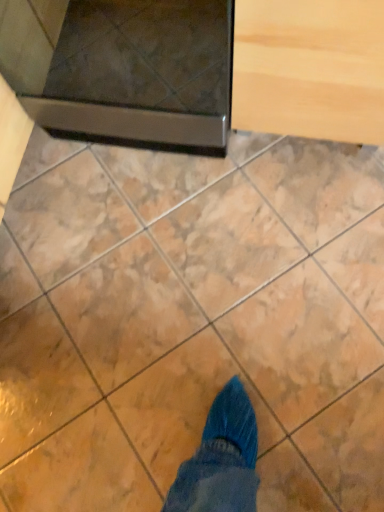
Question: Is metallic dark gray oven at upper left positioned before light wood drawer at upper right?

Choices:
 (A) yes
 (B) no

Answer: (B)

Question: From a real-world perspective, is metallic dark gray oven at upper left on top of light wood drawer at upper right?

Choices:
 (A) yes
 (B) no

Answer: (A)

Question: Is metallic dark gray oven at upper left with light wood drawer at upper right?

Choices:
 (A) no
 (B) yes

Answer: (A)

Question: Can you confirm if metallic dark gray oven at upper left is positioned to the right of light wood drawer at upper right?

Choices:
 (A) yes
 (B) no

Answer: (B)

Question: Would you say light wood drawer at upper right is part of metallic dark gray oven at upper left's contents?

Choices:
 (A) no
 (B) yes

Answer: (A)

Question: From a real-world perspective, is light wood drawer at upper right positioned above or below marble at upper center?

Choices:
 (A) above
 (B) below

Answer: (A)

Question: Is point (261, 53) closer or farther from the camera than point (142, 382)?

Choices:
 (A) closer
 (B) farther

Answer: (A)

Question: In terms of height, does light wood drawer at upper right look taller or shorter compared to marble at upper center?

Choices:
 (A) tall
 (B) short

Answer: (A)

Question: From the image's perspective, is light wood drawer at upper right positioned above or below marble at upper center?

Choices:
 (A) below
 (B) above

Answer: (B)

Question: Is metallic dark gray oven at upper left bigger or smaller than marble at upper center?

Choices:
 (A) big
 (B) small

Answer: (A)

Question: In the image, is metallic dark gray oven at upper left positioned in front of or behind marble at upper center?

Choices:
 (A) behind
 (B) front

Answer: (B)

Question: Visually, is metallic dark gray oven at upper left positioned to the left or to the right of marble at upper center?

Choices:
 (A) left
 (B) right

Answer: (A)

Question: From the image's perspective, is metallic dark gray oven at upper left located above or below marble at upper center?

Choices:
 (A) below
 (B) above

Answer: (B)

Question: From a real-world perspective, is metallic dark gray oven at upper left physically located above or below light wood drawer at upper right?

Choices:
 (A) below
 (B) above

Answer: (B)

Question: Considering the positions of point (112, 99) and point (271, 114), is point (112, 99) closer or farther from the camera than point (271, 114)?

Choices:
 (A) closer
 (B) farther

Answer: (B)